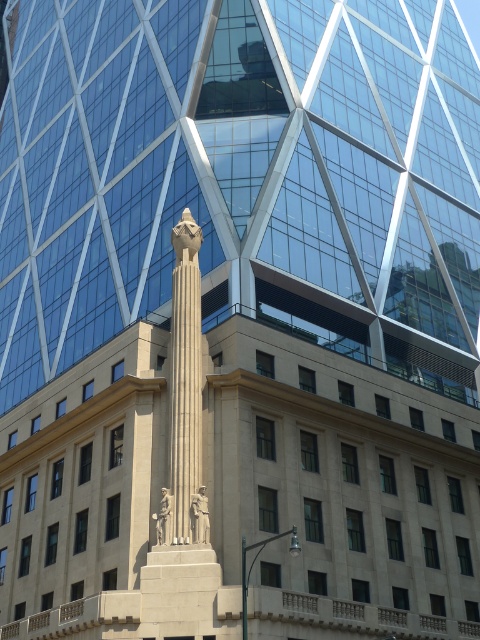
Question: Among these objects, which one is farthest from the camera?

Choices:
 (A) polished bronze statue at center
 (B) stone statue at center

Answer: (A)

Question: Can you confirm if stone statue at center is positioned to the left of polished bronze statue at center?

Choices:
 (A) yes
 (B) no

Answer: (B)

Question: Based on their relative distances, which object is nearer to the polished bronze statue at center?

Choices:
 (A) stone statue at center
 (B) white marble column at center

Answer: (A)

Question: Which point appears farthest from the camera in this image?

Choices:
 (A) (192, 524)
 (B) (180, 422)

Answer: (B)

Question: Does white marble column at center appear over polished bronze statue at center?

Choices:
 (A) no
 (B) yes

Answer: (B)

Question: Does white marble column at center have a lesser width compared to polished bronze statue at center?

Choices:
 (A) no
 (B) yes

Answer: (A)